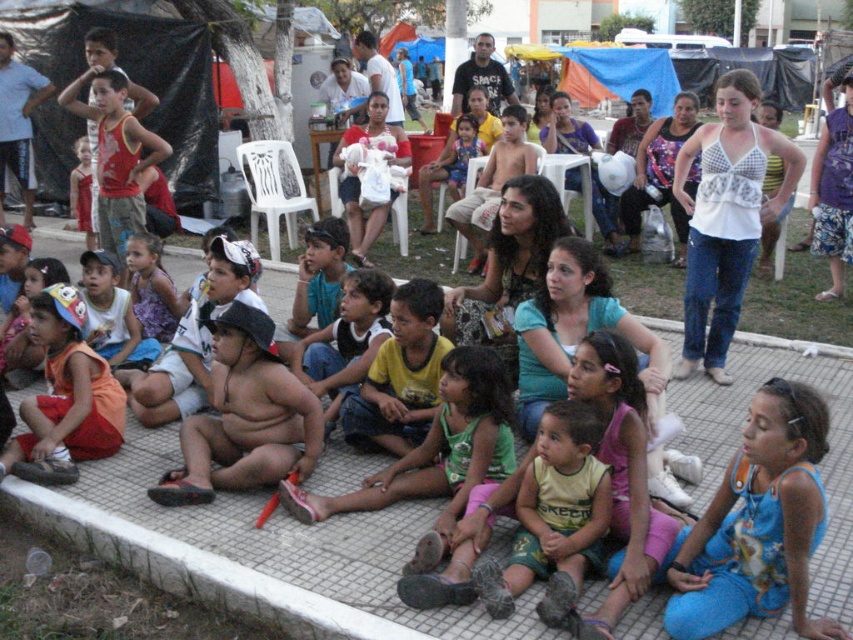
Question: Which of the following is the farthest from the observer?

Choices:
 (A) (277, 445)
 (B) (535, 448)
 (C) (96, 380)
 (D) (41, 508)

Answer: (C)

Question: Which is farther from the yellow-green fabric at center?

Choices:
 (A) orange cotton shirt at lower left
 (B) fat child at center

Answer: (A)

Question: Does fat child at center have a lesser width compared to orange cotton shirt at lower left?

Choices:
 (A) no
 (B) yes

Answer: (A)

Question: Does yellow-green fabric at center lie behind orange cotton shirt at lower left?

Choices:
 (A) yes
 (B) no

Answer: (B)

Question: Among these points, which one is nearest to the camera?

Choices:
 (A) (264, 605)
 (B) (115, 394)
 (C) (309, 452)
 (D) (583, 410)

Answer: (A)

Question: From the image, what is the correct spatial relationship of fat child at center in relation to yellow-green fabric at center?

Choices:
 (A) right
 (B) left

Answer: (B)